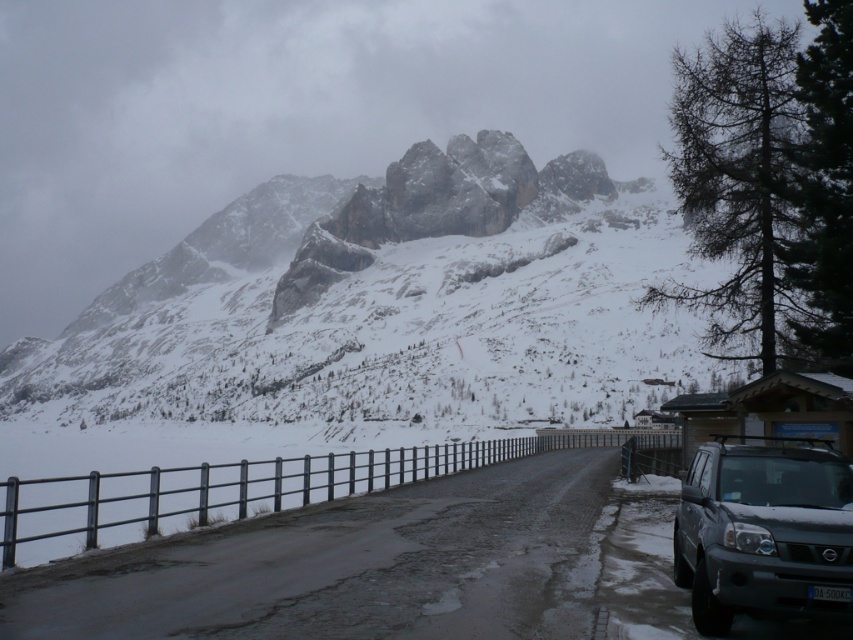
Which is behind, point (334, 317) or point (831, 556)?

Positioned behind is point (334, 317).

Measure the distance between point [386,378] and camera.

Point [386,378] is 110.35 meters from camera.

Is point (546, 228) less distant than point (815, 456)?

No, (546, 228) is behind (815, 456).

The height and width of the screenshot is (640, 853). Find the location of `snowy granite mountain at upper center`. snowy granite mountain at upper center is located at coordinates (386, 301).

You are a GUI agent. You are given a task and a screenshot of the screen. Output one action in this format:
    pyautogui.click(x=<x>, y=<y>)
    Task: Click on the smooth asphalt road at center
    The image size is (853, 640).
    Given the screenshot: What is the action you would take?
    pyautogui.click(x=347, y=564)

Which is in front, point (291, 568) or point (793, 584)?

Point (793, 584) is more forward.

Is point (56, 605) closer to camera compared to point (811, 534)?

That is False.

Locate an element on the screen. This screenshot has width=853, height=640. smooth asphalt road at center is located at coordinates (347, 564).

Does white snow mountain at upper center lie in front of smooth asphalt road at center?

No, it is not.

Between point (149, 202) and point (444, 538), which one is positioned behind?

Point (149, 202)

Identify the location of white snow mountain at upper center. (291, 109).